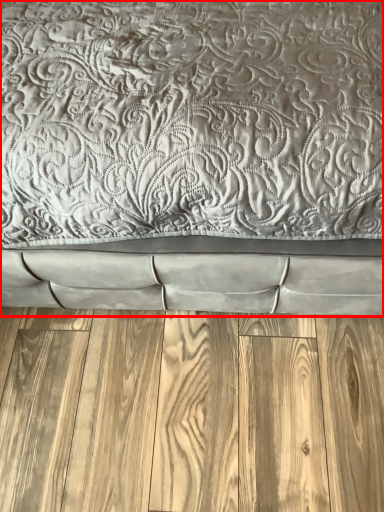
Question: From the image's perspective, what is the correct spatial positioning of bed (annotated by the red box) in reference to hardwood?

Choices:
 (A) above
 (B) below

Answer: (A)